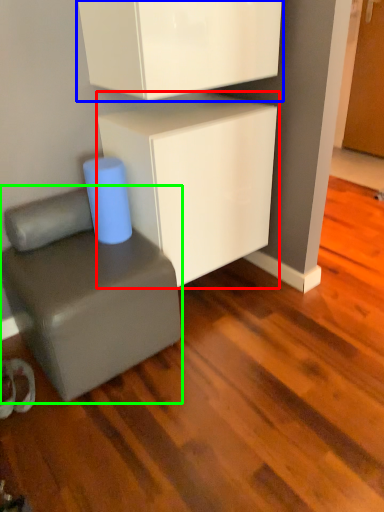
Question: Considering the real-world distances, which object is farthest from cabinetry (highlighted by a red box)? cabinetry (highlighted by a blue box) or furniture (highlighted by a green box)?

Choices:
 (A) cabinetry
 (B) furniture

Answer: (B)